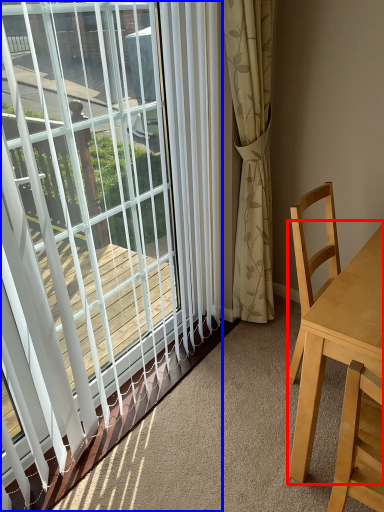
Question: Which point is further to the camera, table (highlighted by a red box) or window (highlighted by a blue box)?

Choices:
 (A) table
 (B) window

Answer: (A)